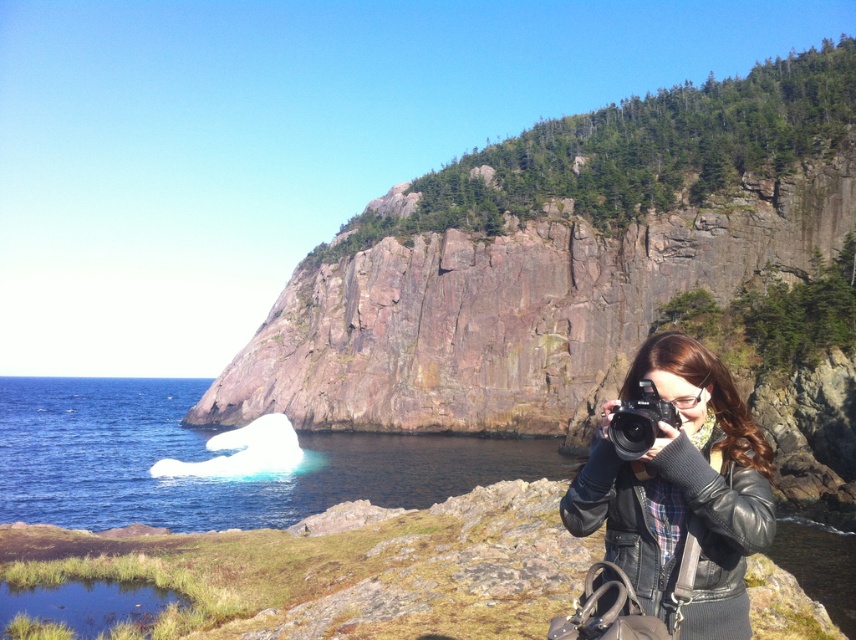
You are a photographer standing on the white ice at lower left and want to move to the black leather jacket at lower right. Considering the height difference between the two, will you need to climb upwards or downwards to reach the jacket?

The white ice at lower left has a greater height compared to the black leather jacket at lower right, so you will need to climb downwards to reach the jacket.